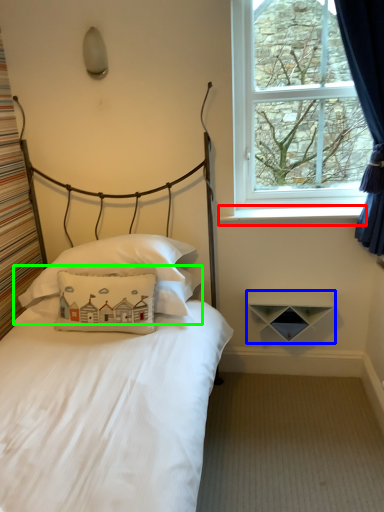
Question: Estimate the real-world distances between objects in this image. Which object is farther from window sill (highlighted by a red box), shelf (highlighted by a blue box) or pillow (highlighted by a green box)?

Choices:
 (A) shelf
 (B) pillow

Answer: (B)